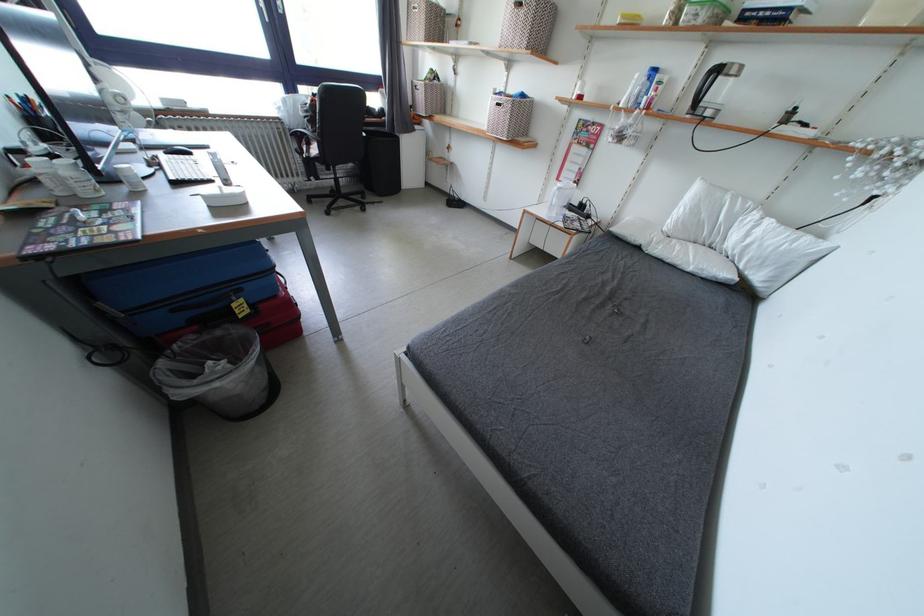
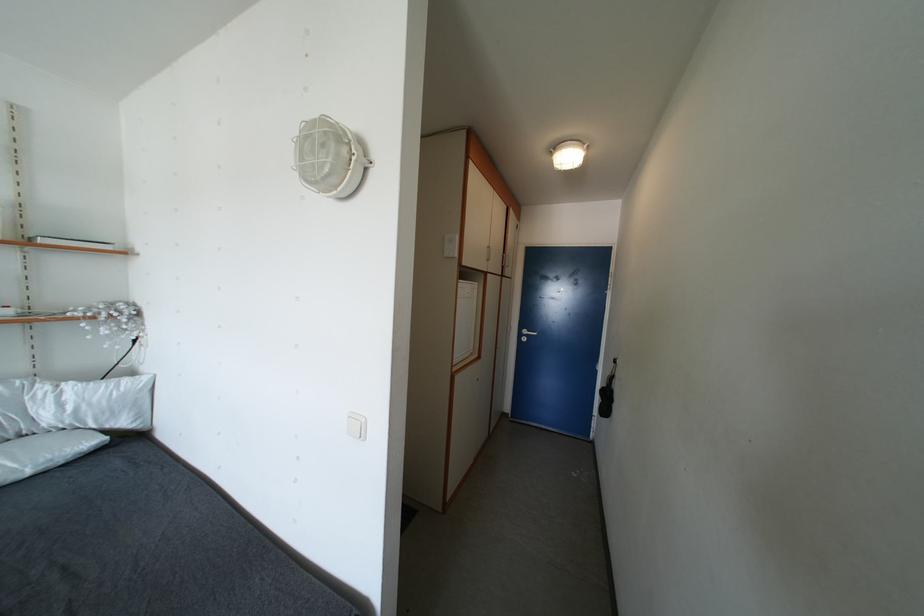
Based on the continuous images, in which direction is the camera rotating?

The camera's rotation is toward right-down.